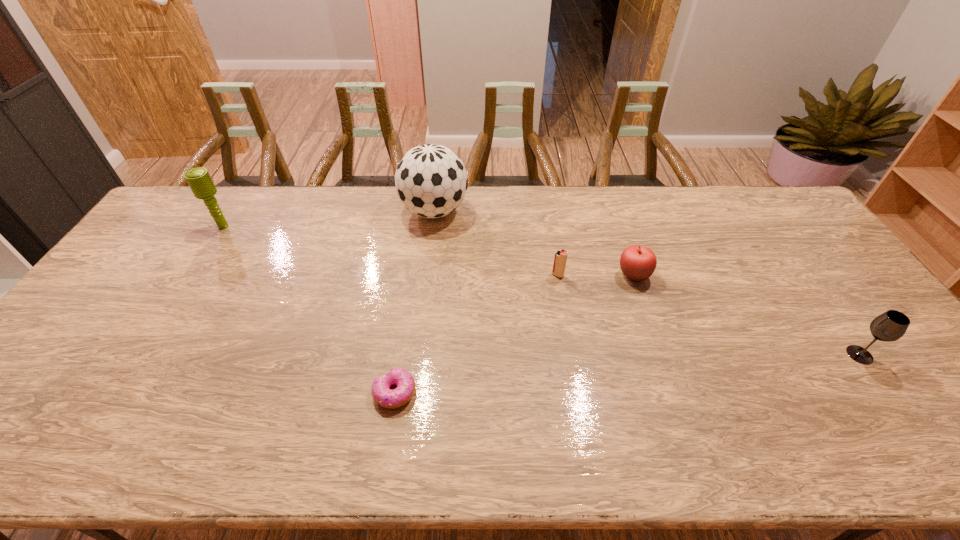
Where is `free region located on the left of the second nearest object`? free region located on the left of the second nearest object is located at coordinates (757, 355).

This screenshot has height=540, width=960. I want to click on vacant space situated on the left of the apple, so click(550, 275).

At what (x,y) coordinates should I click in order to perform the action: click on vacant point located on the left of the third object from right to left. Please return your answer as a coordinate pair (x, y). The image size is (960, 540). Looking at the image, I should click on (462, 275).

Locate an element on the screen. free location located 0.200m on the back of the doughnut is located at coordinates (407, 311).

Where is `soccer ball situated at the far edge`? The width and height of the screenshot is (960, 540). soccer ball situated at the far edge is located at coordinates (431, 180).

At what (x,y) coordinates should I click in order to perform the action: click on microphone at the far edge. Please return your answer as a coordinate pair (x, y). Looking at the image, I should click on (199, 180).

This screenshot has width=960, height=540. I want to click on object that is at the right edge, so click(x=890, y=326).

Where is `free spot at the far edge of the desktop`? This screenshot has height=540, width=960. free spot at the far edge of the desktop is located at coordinates (534, 189).

Identify the location of free region at the near edge of the desktop. (458, 431).

The height and width of the screenshot is (540, 960). Identify the location of free location at the right edge. (807, 232).